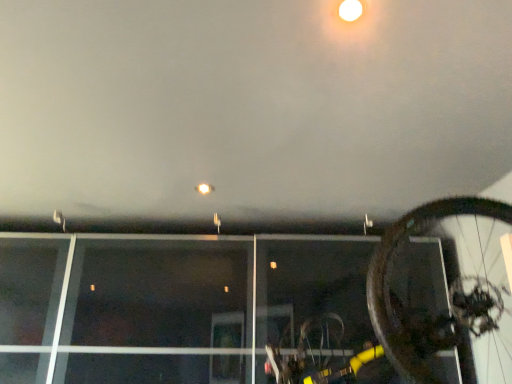
You are a GUI agent. You are given a task and a screenshot of the screen. Output one action in this format:
    pyautogui.click(x=<x>, y=<y>)
    Task: Click on the shiny metallic bicycle wheel at right
    
    Given the screenshot: What is the action you would take?
    pyautogui.click(x=419, y=307)

This screenshot has height=384, width=512. What do you see at coordinates (419, 307) in the screenshot? I see `shiny metallic bicycle wheel at right` at bounding box center [419, 307].

What is the approximate width of shiny metallic bicycle wheel at right?

The width of shiny metallic bicycle wheel at right is 1.08 meters.

This screenshot has width=512, height=384. Describe the element at coordinates (204, 188) in the screenshot. I see `matte white droplight at upper center` at that location.

Locate an element on the screen. The image size is (512, 384). matte white droplight at upper center is located at coordinates (204, 188).

Image resolution: width=512 pixels, height=384 pixels. I want to click on shiny metallic bicycle wheel at right, so click(x=419, y=307).

In the image, is matte white droplight at upper center on the left side or the right side of shiny metallic bicycle wheel at right?

In the image, matte white droplight at upper center appears on the left side of shiny metallic bicycle wheel at right.

In the scene shown: Is matte white droplight at upper center positioned in front of shiny metallic bicycle wheel at right?

No, matte white droplight at upper center is further to the viewer.

Which is farther from the camera, (198, 189) or (501, 210)?

Positioned behind is point (198, 189).

From the image's perspective, between matte white droplight at upper center and shiny metallic bicycle wheel at right, which one is located above?

matte white droplight at upper center is shown above in the image.

From a real-world perspective, is matte white droplight at upper center physically located above or below shiny metallic bicycle wheel at right?

In terms of real-world spatial position, matte white droplight at upper center is above shiny metallic bicycle wheel at right.

Does matte white droplight at upper center have a lesser width compared to shiny metallic bicycle wheel at right?

Correct, the width of matte white droplight at upper center is less than that of shiny metallic bicycle wheel at right.

Between matte white droplight at upper center and shiny metallic bicycle wheel at right, which one has more height?

Standing taller between the two is shiny metallic bicycle wheel at right.

Who is bigger, matte white droplight at upper center or shiny metallic bicycle wheel at right?

With larger size is shiny metallic bicycle wheel at right.

In the scene shown: Is matte white droplight at upper center completely or partially outside of shiny metallic bicycle wheel at right?

Absolutely, matte white droplight at upper center is external to shiny metallic bicycle wheel at right.

Are matte white droplight at upper center and shiny metallic bicycle wheel at right located far from each other?

Yes, matte white droplight at upper center and shiny metallic bicycle wheel at right are quite far apart.

Could you tell me if matte white droplight at upper center is facing shiny metallic bicycle wheel at right?

No, matte white droplight at upper center is not turned towards shiny metallic bicycle wheel at right.

Can you tell me how much matte white droplight at upper center and shiny metallic bicycle wheel at right differ in facing direction?

173 degrees separate the facing orientations of matte white droplight at upper center and shiny metallic bicycle wheel at right.

The height and width of the screenshot is (384, 512). I want to click on bicycle lying on the right of matte white droplight at upper center, so click(419, 307).

Is shiny metallic bicycle wheel at right to the right of matte white droplight at upper center from the viewer's perspective?

Yes, shiny metallic bicycle wheel at right is to the right of matte white droplight at upper center.

In the image, is shiny metallic bicycle wheel at right positioned in front of or behind matte white droplight at upper center?

Clearly, shiny metallic bicycle wheel at right is in front of matte white droplight at upper center.

Is point (428, 380) in front of point (208, 188)?

Yes, point (428, 380) is closer to viewer.

From the image's perspective, between shiny metallic bicycle wheel at right and matte white droplight at upper center, which one is located above?

matte white droplight at upper center appears higher in the image.

From a real-world perspective, is shiny metallic bicycle wheel at right physically located above or below matte white droplight at upper center?

In terms of real-world spatial position, shiny metallic bicycle wheel at right is below matte white droplight at upper center.

Considering the relative sizes of shiny metallic bicycle wheel at right and matte white droplight at upper center in the image provided, is shiny metallic bicycle wheel at right thinner than matte white droplight at upper center?

Incorrect, the width of shiny metallic bicycle wheel at right is not less than that of matte white droplight at upper center.

Who is taller, shiny metallic bicycle wheel at right or matte white droplight at upper center?

Standing taller between the two is shiny metallic bicycle wheel at right.

Is shiny metallic bicycle wheel at right bigger than matte white droplight at upper center?

Correct, shiny metallic bicycle wheel at right is larger in size than matte white droplight at upper center.

Choose the correct answer: Is shiny metallic bicycle wheel at right inside matte white droplight at upper center or outside it?

shiny metallic bicycle wheel at right is located beyond the bounds of matte white droplight at upper center.

Is shiny metallic bicycle wheel at right touching matte white droplight at upper center?

shiny metallic bicycle wheel at right and matte white droplight at upper center are not in contact.

In the scene shown: Is shiny metallic bicycle wheel at right looking in the opposite direction of matte white droplight at upper center?

That's not correct — shiny metallic bicycle wheel at right is not looking away from matte white droplight at upper center.

What's the angular difference between shiny metallic bicycle wheel at right and matte white droplight at upper center's facing directions?

The facing directions of shiny metallic bicycle wheel at right and matte white droplight at upper center are 173 degrees apart.

How far apart are shiny metallic bicycle wheel at right and matte white droplight at upper center?

shiny metallic bicycle wheel at right is 3.60 feet from matte white droplight at upper center.

Find the location of `droplight above the shiny metallic bicycle wheel at right (from the image's perspective)`. droplight above the shiny metallic bicycle wheel at right (from the image's perspective) is located at coordinates (204, 188).

Where is `droplight positioned vertically above the shiny metallic bicycle wheel at right (from a real-world perspective)`? The height and width of the screenshot is (384, 512). droplight positioned vertically above the shiny metallic bicycle wheel at right (from a real-world perspective) is located at coordinates click(204, 188).

Locate an element on the screen. The image size is (512, 384). bicycle located below the matte white droplight at upper center (from the image's perspective) is located at coordinates (419, 307).